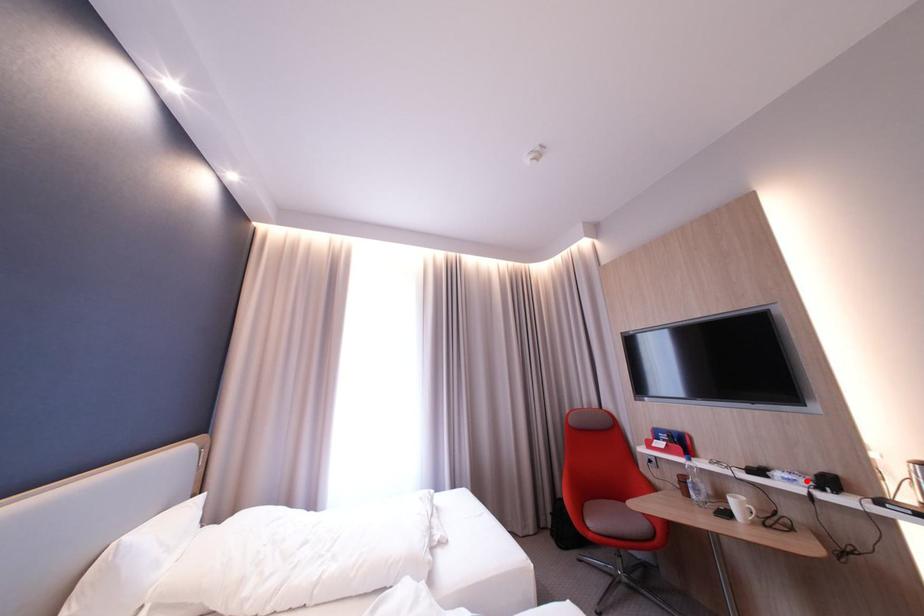
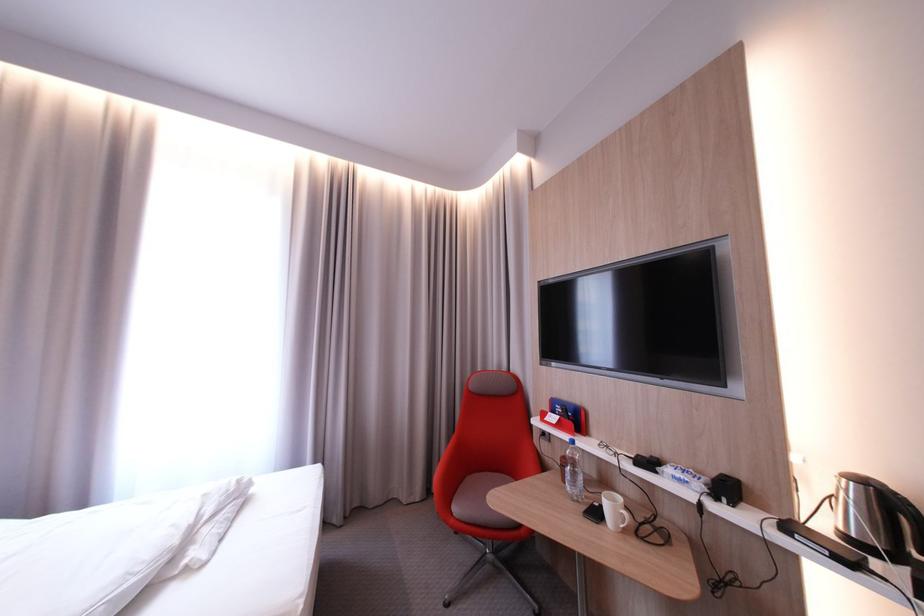
Find the pixel in the second image that matches the highlighted location in the first image.

(699, 483)